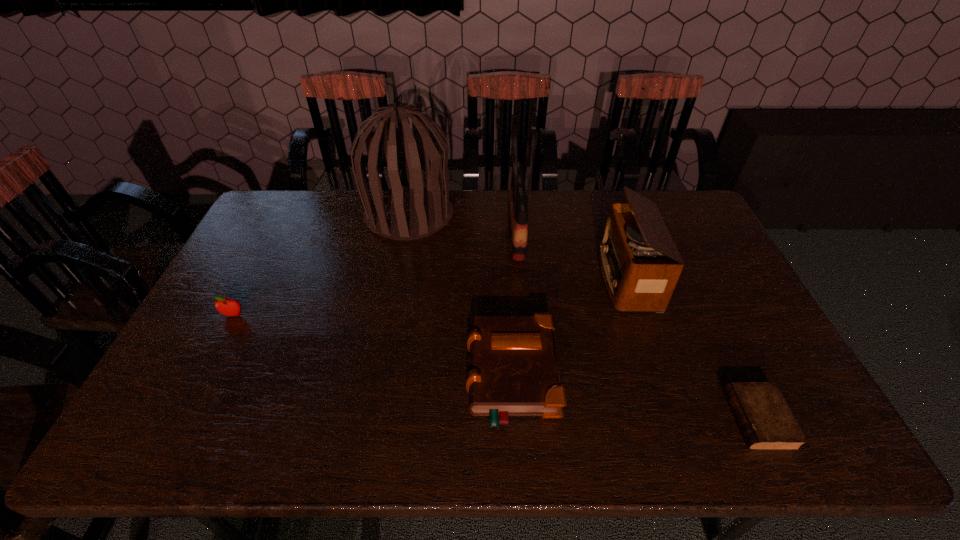
At what (x,y) coordinates should I click in order to perform the action: click on birdcage. Please return your answer as a coordinate pair (x, y). Image resolution: width=960 pixels, height=540 pixels. Looking at the image, I should click on (407, 213).

This screenshot has width=960, height=540. What are the coordinates of `shopping bag` in the screenshot? It's located at (517, 208).

The image size is (960, 540). I want to click on the second object from right to left, so click(x=640, y=263).

Image resolution: width=960 pixels, height=540 pixels. Find the location of `radio receiver`. radio receiver is located at coordinates (640, 263).

Identify the location of the leftmost object. (229, 307).

At what (x,y) coordinates should I click in order to perform the action: click on Bible. Please return your answer as a coordinate pair (x, y). The width and height of the screenshot is (960, 540). Looking at the image, I should click on (513, 371).

This screenshot has width=960, height=540. In order to click on diary in this screenshot , I will do `click(766, 422)`.

Where is `the shortest object`? The image size is (960, 540). the shortest object is located at coordinates pos(766,422).

Find the location of a particular element. free location located on the front of the second object from left to right is located at coordinates (387, 335).

You are a GUI agent. You are given a task and a screenshot of the screen. Output one action in this format:
    pyautogui.click(x=<x>, y=<y>)
    Task: Click on the vacant region located on the front-facing side of the shopping bag
    The width and height of the screenshot is (960, 540).
    Given the screenshot: What is the action you would take?
    pyautogui.click(x=444, y=234)